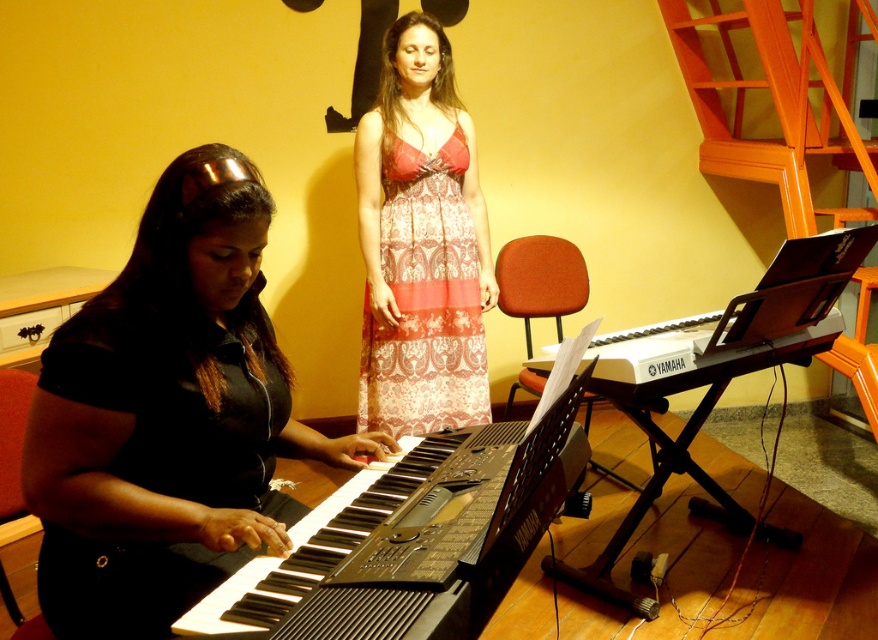
From the picture: You are a photographer setting up a shoot in this room. You need to place a large tripod between the patterned fabric dress at center and the black plastic keyboard at right. Which object should the tripod be closer to if it needs to be near the larger object?

The patterned fabric dress at center is larger than the black plastic keyboard at right, so the tripod should be placed closer to the patterned fabric dress at center.

You are standing in the room and want to move to the point marked as point (416, 465). Can you reach it without moving past the Yamaha keyboard?

The distance between you and point (416, 465) is 1.53 meters. Since the Yamaha keyboard is in the foreground and you need to move around it, you might need to go around it to reach the point. However, the exact path depends on the keyboard and seating arrangement. Without additional information about obstacles between you and the point, it is uncertain if you can reach it without moving past the Yamaha keyboard.

You are a photographer setting up a shoot in this room. You need to place a 1.2 meter tall tripod between the patterned fabric dress at center and the black plastic keyboard at lower left. Can the tripod fit vertically between them without touching either object?

The patterned fabric dress at center is taller than the black plastic keyboard at lower left. Since the tripod is 1.2 meters tall, and the dress is taller than the keyboard, the minimum height between them would be determined by the keyboard. However, without specific height measurements for the objects, it is impossible to confirm if the tripod can fit vertically without more information.